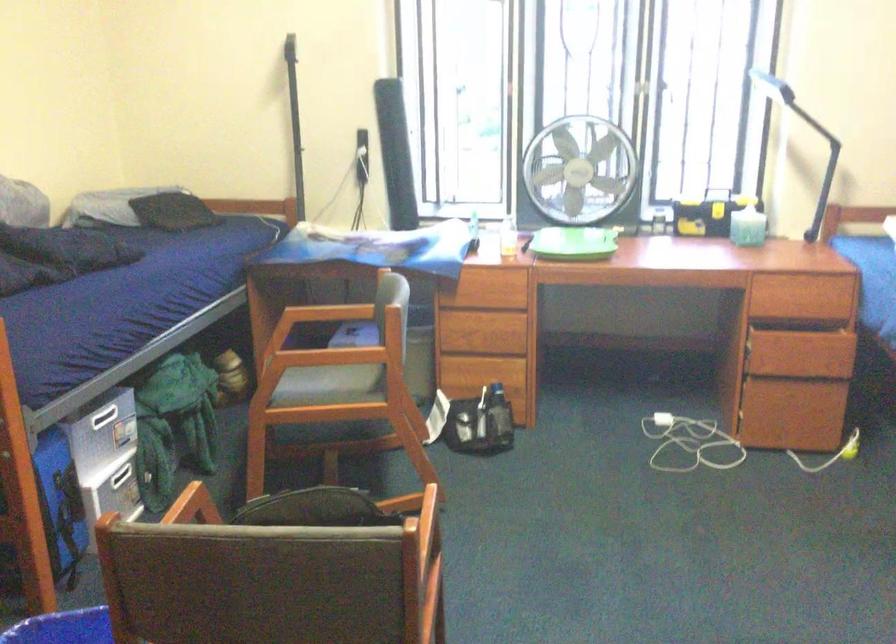
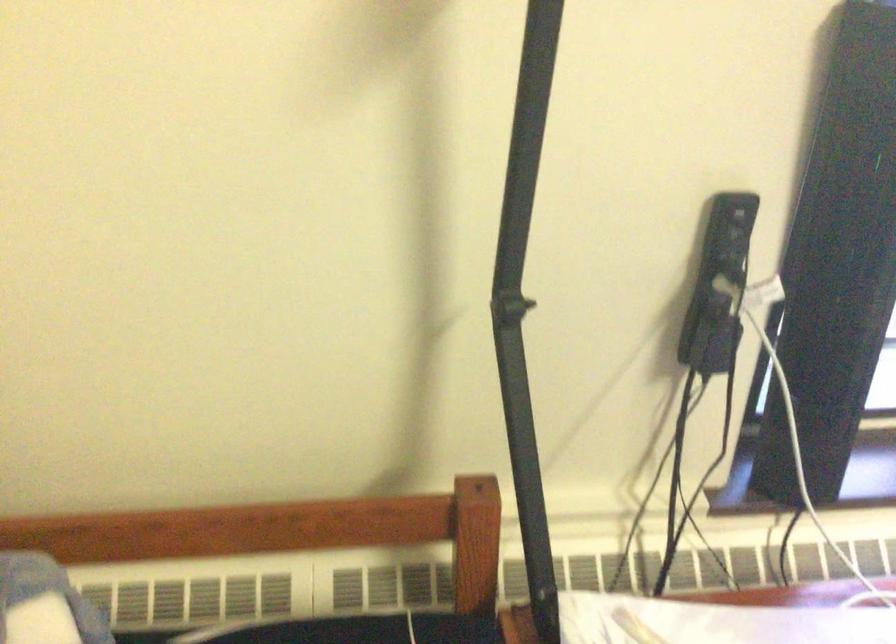
Question: In a continuous first-person perspective shot, in which direction is the camera moving?

Choices:
 (A) Left
 (B) Right
 (C) Forward
 (D) Backward

Answer: (C)